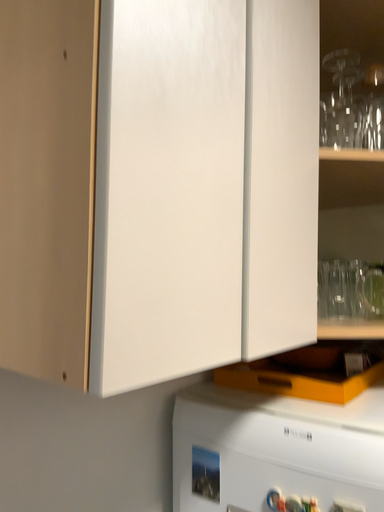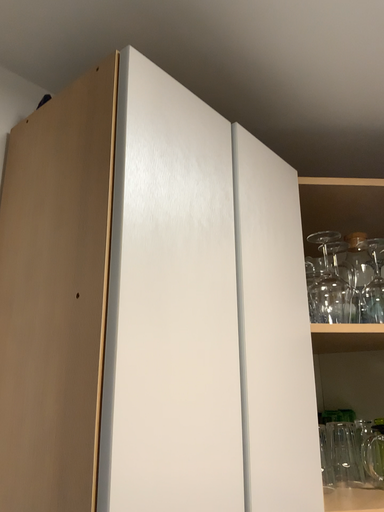
Question: How did the camera likely rotate when shooting the video?

Choices:
 (A) rotated upward
 (B) rotated downward

Answer: (A)